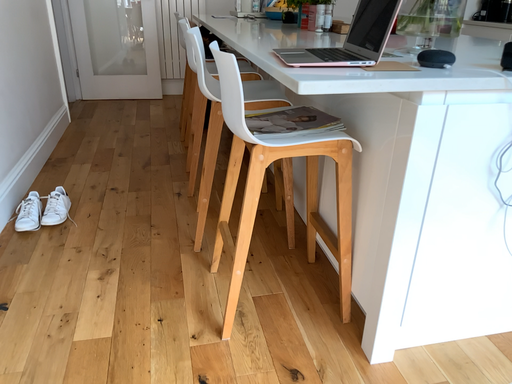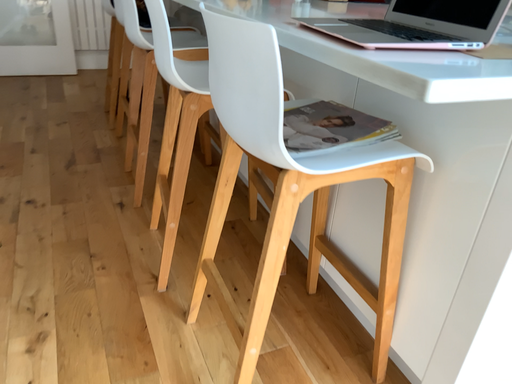
Question: Which way did the camera rotate in the video?

Choices:
 (A) rotated right
 (B) rotated left

Answer: (A)